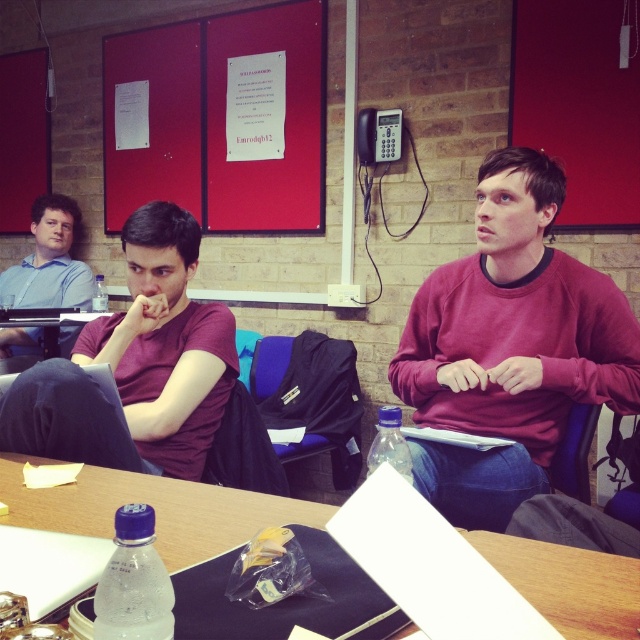
Does red matte board at upper left have a lesser height compared to wooden table at center?

No.

Between red matte board at upper left and wooden table at center, which one appears on the left side from the viewer's perspective?

red matte board at upper left is more to the left.

Does point (182, 144) come farther from viewer compared to point (224, 531)?

Yes.

The width and height of the screenshot is (640, 640). I want to click on red matte board at upper left, so click(220, 120).

Is maroon sweatshirt at center closer to camera compared to matte blue shirt at left?

Yes, maroon sweatshirt at center is in front of matte blue shirt at left.

The width and height of the screenshot is (640, 640). Identify the location of maroon sweatshirt at center. click(x=509, y=348).

You are a GUI agent. You are given a task and a screenshot of the screen. Output one action in this format:
    pyautogui.click(x=<x>, y=<y>)
    Task: Click on the maroon sweatshirt at center
    This screenshot has width=640, height=640.
    Given the screenshot: What is the action you would take?
    pyautogui.click(x=509, y=348)

Can you confirm if wooden table at center is positioned to the left of matte blue shirt at left?

No, wooden table at center is not to the left of matte blue shirt at left.

Which is more to the left, wooden table at center or matte blue shirt at left?

matte blue shirt at left is more to the left.

Find the location of a particular element. This screenshot has height=640, width=640. wooden table at center is located at coordinates tap(154, 508).